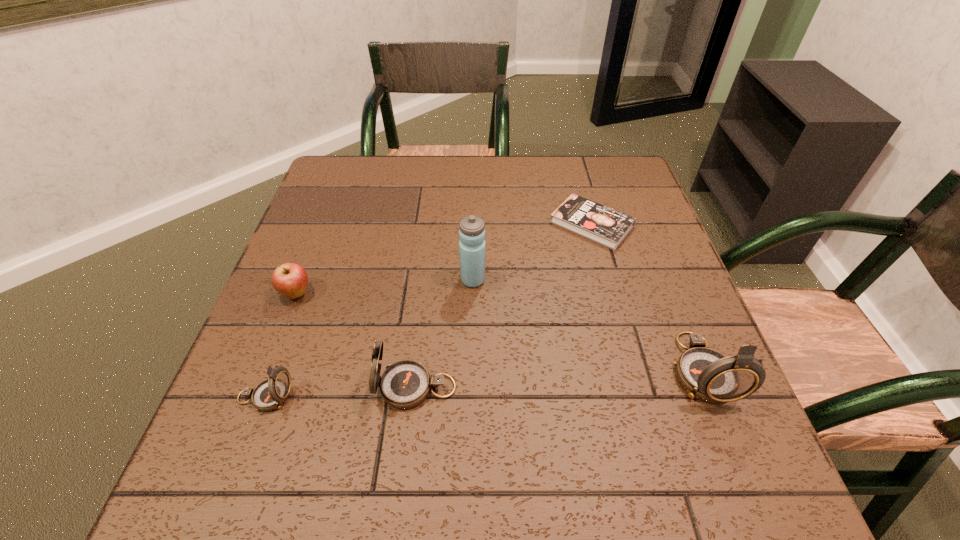
If equal spacing is desired by inserting an extra compass among them, please point out a free spot for this new compass. Please provide its 2D coordinates. Your answer should be formatted as a tuple, i.e. [(x, y)], where the tuple contains the x and y coordinates of a point satisfying the conditions above.

[(561, 378)]